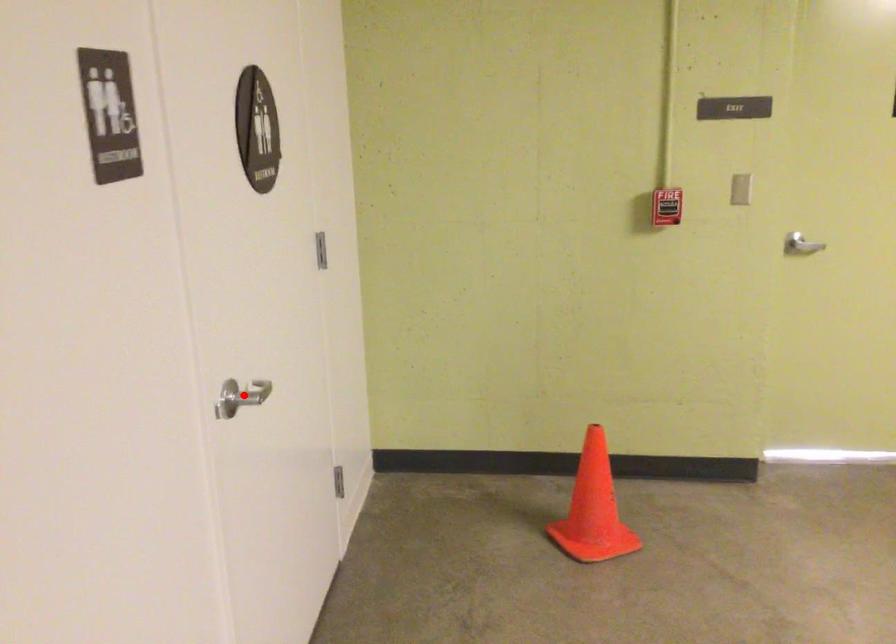
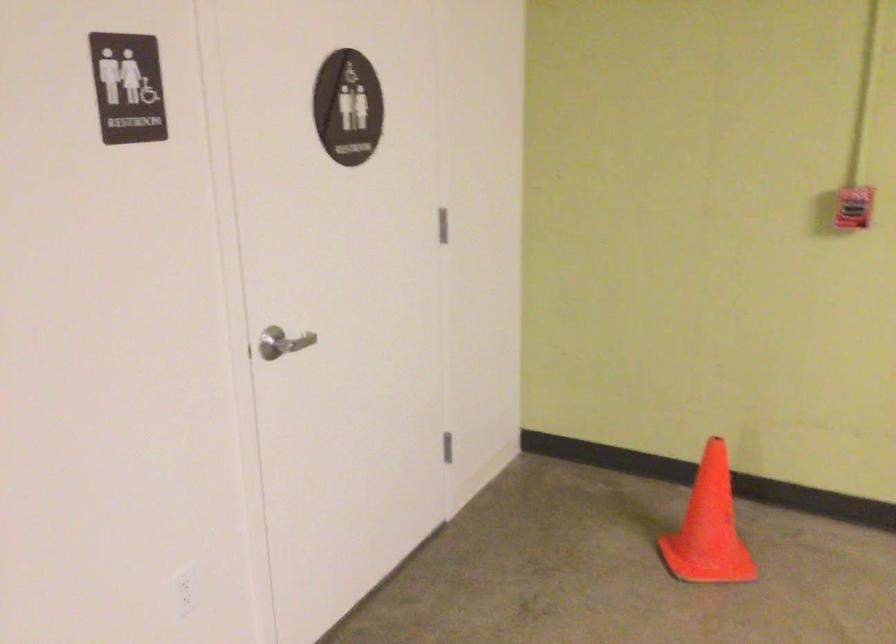
Find the pixel in the second image that matches the highlighted location in the first image.

(281, 343)